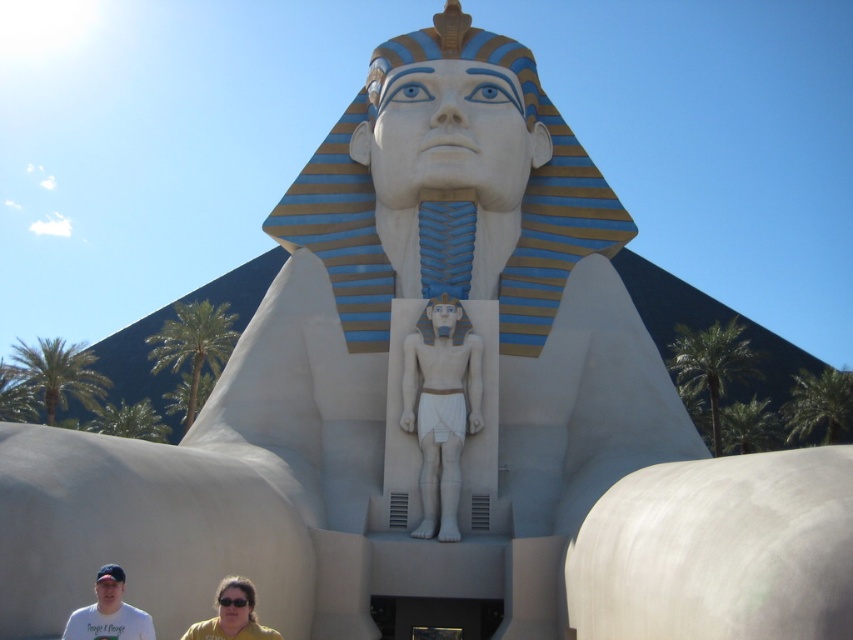
Question: Is yellow t-shirt at lower center bigger than white t-shirt at lower left?

Choices:
 (A) no
 (B) yes

Answer: (B)

Question: Is white t-shirt at lower left wider than yellow fabric shirt at lower center?

Choices:
 (A) no
 (B) yes

Answer: (B)

Question: Which object is the closest to the yellow t-shirt at lower center?

Choices:
 (A) white t-shirt at lower left
 (B) white marble statue at center
 (C) yellow fabric shirt at lower center

Answer: (A)

Question: Can you confirm if white t-shirt at lower left is wider than yellow fabric shirt at lower center?

Choices:
 (A) no
 (B) yes

Answer: (B)

Question: Which object is positioned farthest from the white t-shirt at lower left?

Choices:
 (A) yellow fabric shirt at lower center
 (B) white marble statue at center

Answer: (B)

Question: Which of the following is the farthest from the observer?

Choices:
 (A) (444, 316)
 (B) (271, 628)
 (C) (206, 621)
 (D) (148, 634)

Answer: (A)